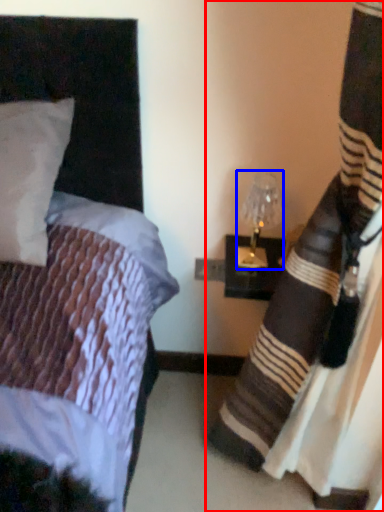
Question: Which object appears farthest to the camera in this image, curtain (highlighted by a red box) or bedside lamp (highlighted by a blue box)?

Choices:
 (A) curtain
 (B) bedside lamp

Answer: (B)